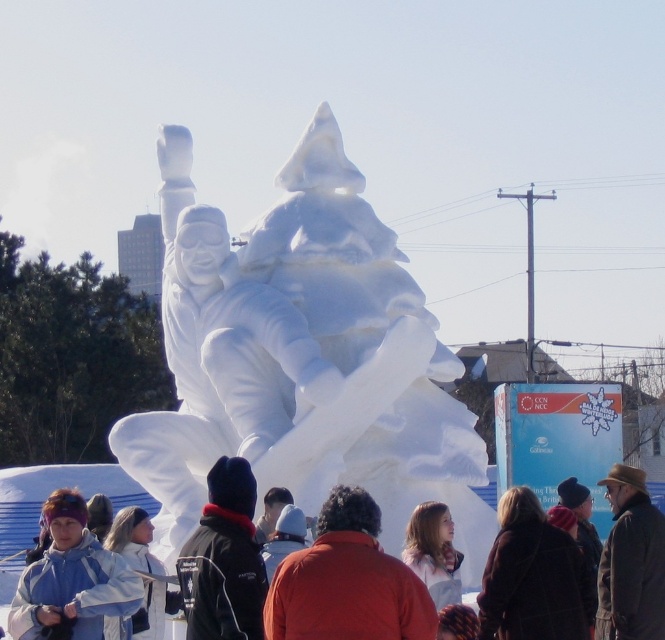
You are a photographer standing at the center of the winter event area. You want to take a photo of both the dark brown coat at lower right and the brown leather hat at lower right in the same frame. Given that your camera has a maximum focus range of 5 meters, will you be able to capture both objects clearly in one shot?

The dark brown coat at lower right is 4.72 meters away from the brown leather hat at lower right. Since the distance between them is within the camera maximum focus range of 5 meters, you can capture both objects clearly in one shot.

You are a photographer planning to take a photo of the white snow sculpture at center and the black fleece jacket at center. Since you want to highlight the height difference between them, which object should you position closer to the camera to emphasize their size difference?

To emphasize the height difference between the white snow sculpture at center and the black fleece jacket at center, you should position the black fleece jacket at center closer to the camera. Since the white snow sculpture at center is much taller, placing the shorter object nearer will visually exaggerate the size contrast between them.